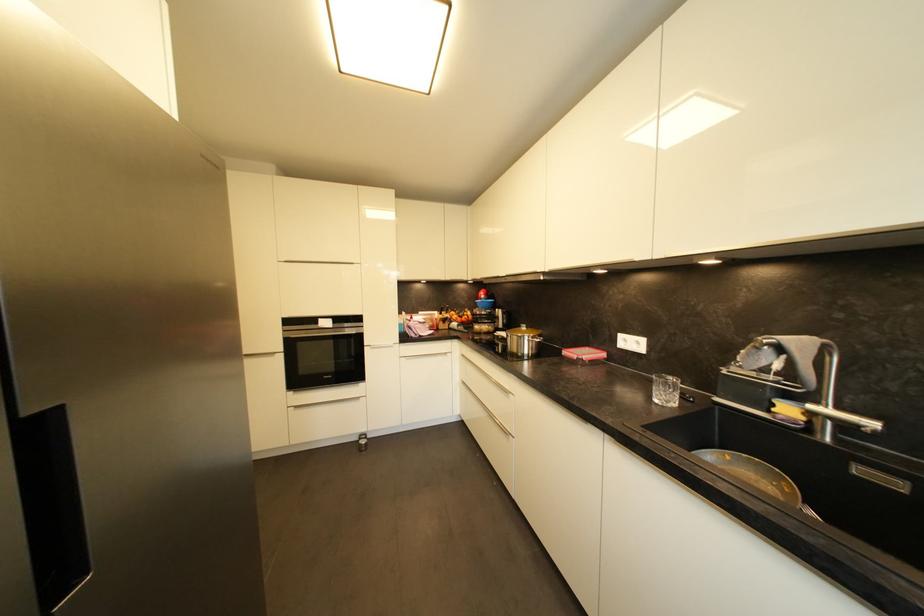
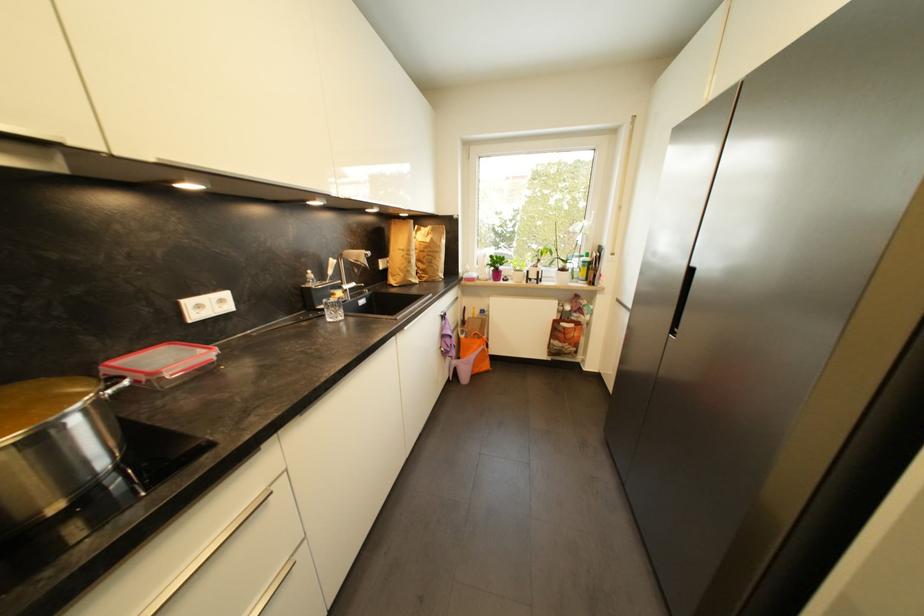
Where in the second image is the point corresponding to pixel 844 410 from the first image?

(353, 285)